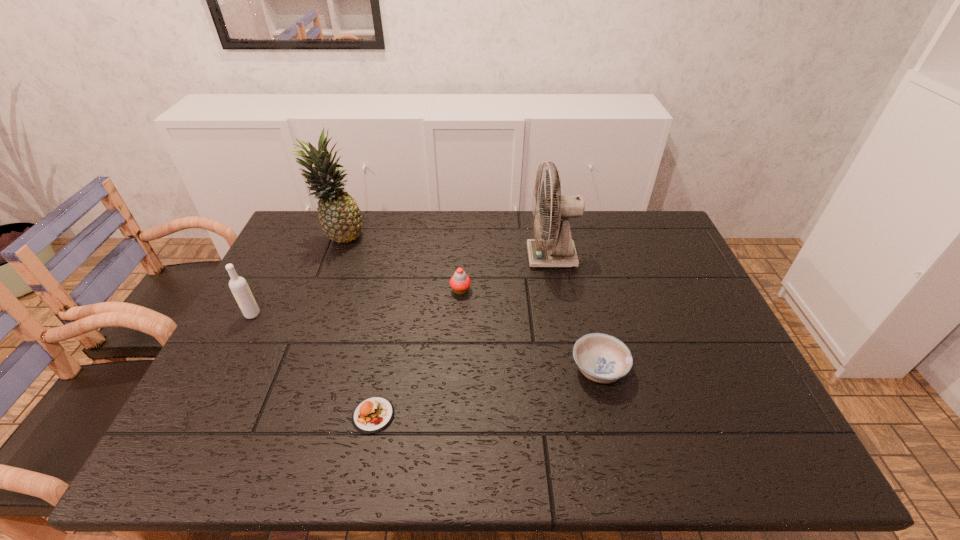
This screenshot has height=540, width=960. Find the location of `free point between the cupcake and the pineapple`. free point between the cupcake and the pineapple is located at coordinates (400, 264).

You are a GUI agent. You are given a task and a screenshot of the screen. Output one action in this format:
    pyautogui.click(x=<x>, y=<y>)
    Task: Click on the unoccupied position between the second nearest object and the fan
    This screenshot has height=540, width=960.
    Given the screenshot: What is the action you would take?
    pyautogui.click(x=575, y=313)

Identify the location of empty space between the bowl and the fifth object from right to left. (468, 303).

Where is `vacant space that's between the fifth object from right to left and the third nearest object`? vacant space that's between the fifth object from right to left and the third nearest object is located at coordinates (296, 275).

At what (x,y) coordinates should I click in order to perform the action: click on free space between the bowl and the nearest object. Please return your answer as a coordinate pair (x, y). Looking at the image, I should click on (486, 392).

What are the coordinates of `free space that is in between the nearest object and the fifth object from right to left` in the screenshot? It's located at (356, 326).

This screenshot has height=540, width=960. Identify the location of vacant space that's between the fan and the third object from left to right. (463, 336).

At what (x,y) coordinates should I click in order to perform the action: click on free spot between the vodka and the pineapple. Please return your answer as a coordinate pair (x, y). This screenshot has width=960, height=540. Looking at the image, I should click on (296, 275).

At what (x,y) coordinates should I click in order to perform the action: click on vacant point located between the pineapple and the leftmost object. Please return your answer as a coordinate pair (x, y). The image size is (960, 540). Looking at the image, I should click on (296, 275).

Image resolution: width=960 pixels, height=540 pixels. Find the location of `object that is the closest to the third object from right to left`. object that is the closest to the third object from right to left is located at coordinates (560, 251).